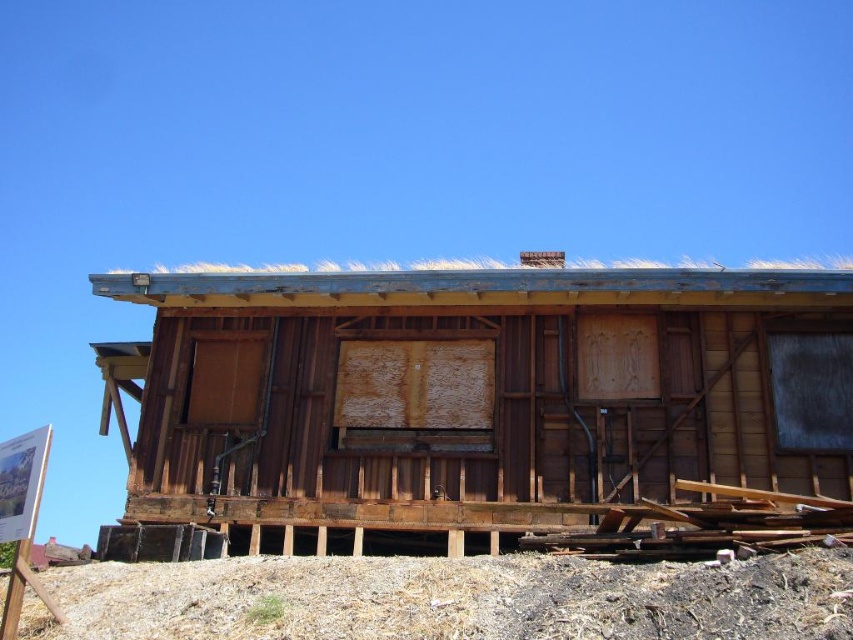
You are a construction worker assessing the site. You notice the wooden at center and the brown dirt at lower center. Which of these two objects has a smaller width?

The wooden at center has a lesser width compared to brown dirt at lower center, so the wooden at center is smaller in width.

You are standing at the entrance of the partially constructed wooden structure. You see wooden at center and brown dirt at lower center. Which object is positioned to the right of the other?

The wooden at center is positioned to the right of brown dirt at lower center.